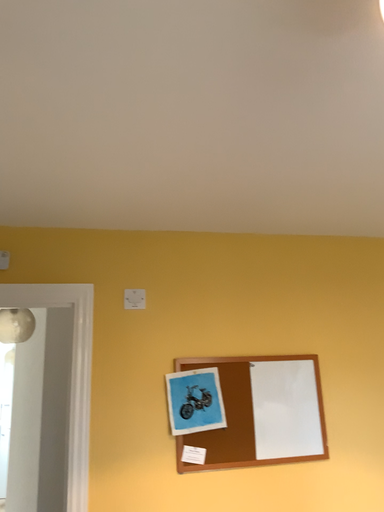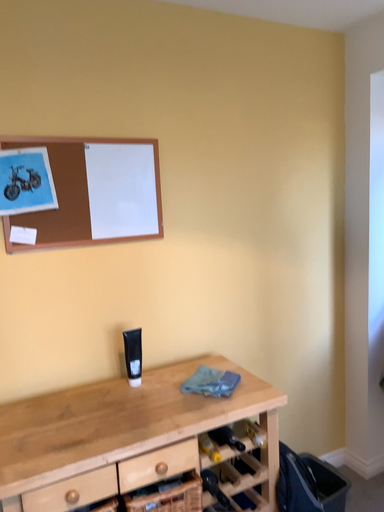
Question: How did the camera likely rotate when shooting the video?

Choices:
 (A) rotated upward
 (B) rotated downward

Answer: (B)